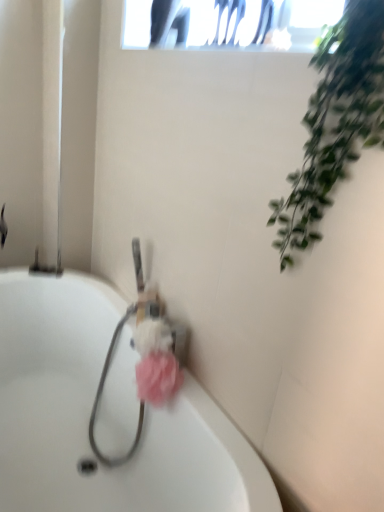
Question: From the image's perspective, is green leafy plant at upper right above or below pink fluffy loofah at center, positioned as the 1th flower in top-to-bottom order?

Choices:
 (A) above
 (B) below

Answer: (A)

Question: Is green leafy plant at upper right taller or shorter than pink fluffy loofah at center, acting as the second flower starting from the bottom?

Choices:
 (A) short
 (B) tall

Answer: (B)

Question: Which is farther from the pink fluffy sponge at center, which is counted as the first flower, starting from the bottom?

Choices:
 (A) pink fluffy loofah at center, acting as the second flower starting from the bottom
 (B) green leafy plant at upper right
 (C) white glossy bathtub at center
 (D) pink fluffy sponge at center

Answer: (B)

Question: Which is farther from the green leafy plant at upper right?

Choices:
 (A) white glossy bathtub at center
 (B) pink fluffy loofah at center, acting as the second flower starting from the bottom
 (C) pink fluffy sponge at center, which is counted as the first flower, starting from the bottom
 (D) pink fluffy sponge at center

Answer: (A)